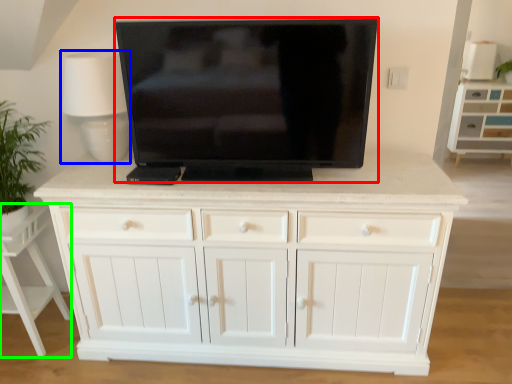
Question: Which is farther away from television (highlighted by a red box)? table lamp (highlighted by a blue box) or vanity (highlighted by a green box)?

Choices:
 (A) table lamp
 (B) vanity

Answer: (B)